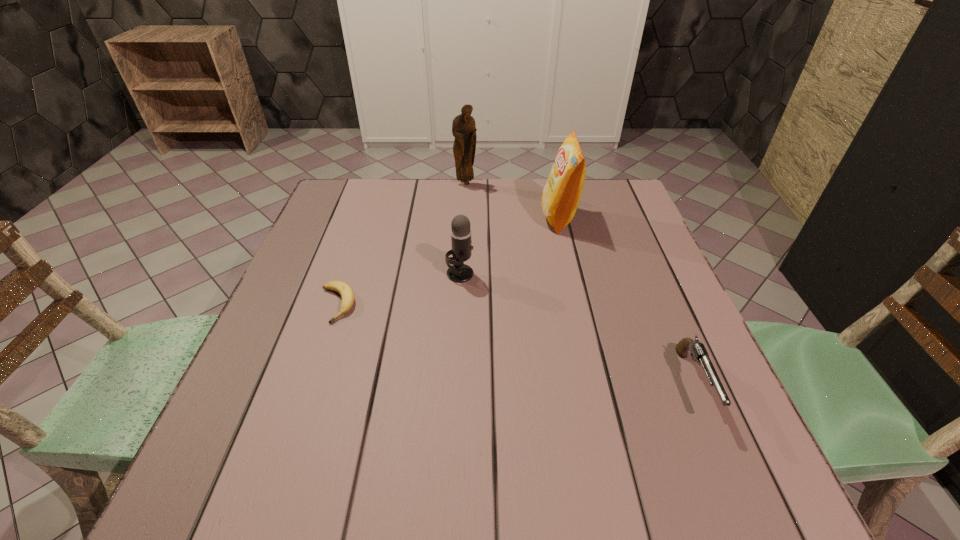
I want to click on blank space at the far edge of the desktop, so pyautogui.click(x=420, y=213).

This screenshot has width=960, height=540. In order to click on vacant position at the left edge of the desktop in this screenshot , I will do `click(267, 440)`.

The width and height of the screenshot is (960, 540). In the image, there is a desktop. Find the location of `vacant space at the right edge`. vacant space at the right edge is located at coordinates tap(639, 224).

The width and height of the screenshot is (960, 540). In the image, there is a desktop. Identify the location of vacant space at the far left corner. (324, 220).

Find the location of `free region at the near left corner of the desktop`. free region at the near left corner of the desktop is located at coordinates (259, 464).

Where is `unoccupied position between the farthest object and the crisp (potato chip)`? This screenshot has width=960, height=540. unoccupied position between the farthest object and the crisp (potato chip) is located at coordinates (513, 200).

Find the location of a particular element. This screenshot has height=540, width=960. vacant area between the gun and the second farthest object is located at coordinates (627, 300).

The width and height of the screenshot is (960, 540). What are the coordinates of `free spot between the fourth nearest object and the microphone` in the screenshot? It's located at (510, 246).

This screenshot has height=540, width=960. I want to click on free area in between the fourth farthest object and the gun, so click(516, 344).

In order to click on vacant space that is in between the fourth object from left to right and the farthest object in this screenshot , I will do `click(513, 200)`.